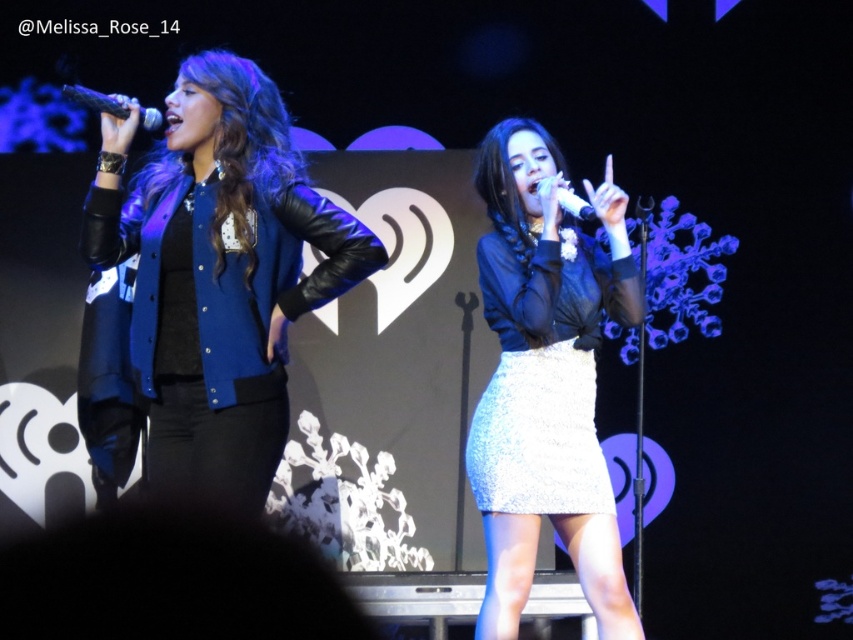
Question: Observing the image, what is the correct spatial positioning of matte blue leather jacket at left in reference to satin white skirt at center?

Choices:
 (A) right
 (B) left

Answer: (B)

Question: Which object is closer to the camera taking this photo?

Choices:
 (A) satin white skirt at center
 (B) matte blue leather jacket at left
 (C) matte black microphone at center

Answer: (B)

Question: Where is black matte microphone at upper left located in relation to matte black microphone at center in the image?

Choices:
 (A) left
 (B) right

Answer: (A)

Question: Which is nearer to the matte blue leather jacket at left?

Choices:
 (A) black matte microphone at upper left
 (B) matte black microphone at center
 (C) satin white skirt at center

Answer: (A)

Question: Is black matte microphone at upper left bigger than matte black microphone at center?

Choices:
 (A) yes
 (B) no

Answer: (B)

Question: Which is nearer to the matte black microphone at center?

Choices:
 (A) satin white skirt at center
 (B) black matte microphone at upper left

Answer: (A)